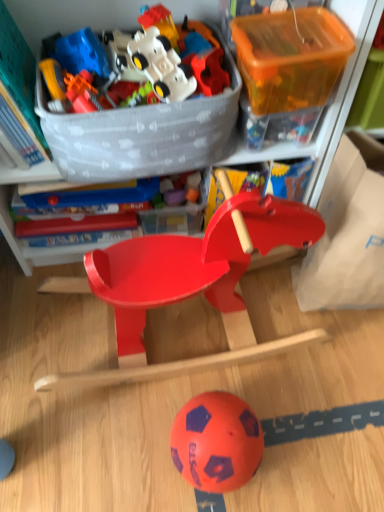
I want to click on vacant space in between orange rubber ball at lower center and matte plastic rocking horse at center, the 6th toy viewed from the top, so click(x=182, y=403).